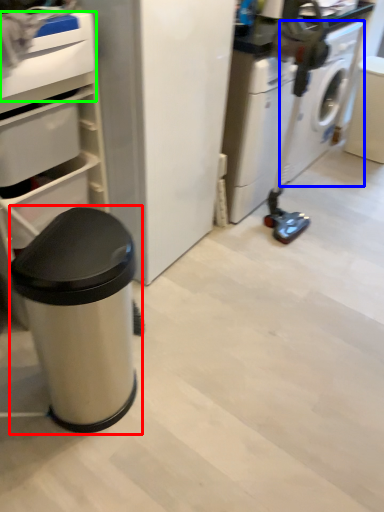
Question: Which object is positioned closest to waste container (highlighted by a red box)? Select from washing machine (highlighted by a blue box) and drawer (highlighted by a green box).

Choices:
 (A) washing machine
 (B) drawer

Answer: (B)